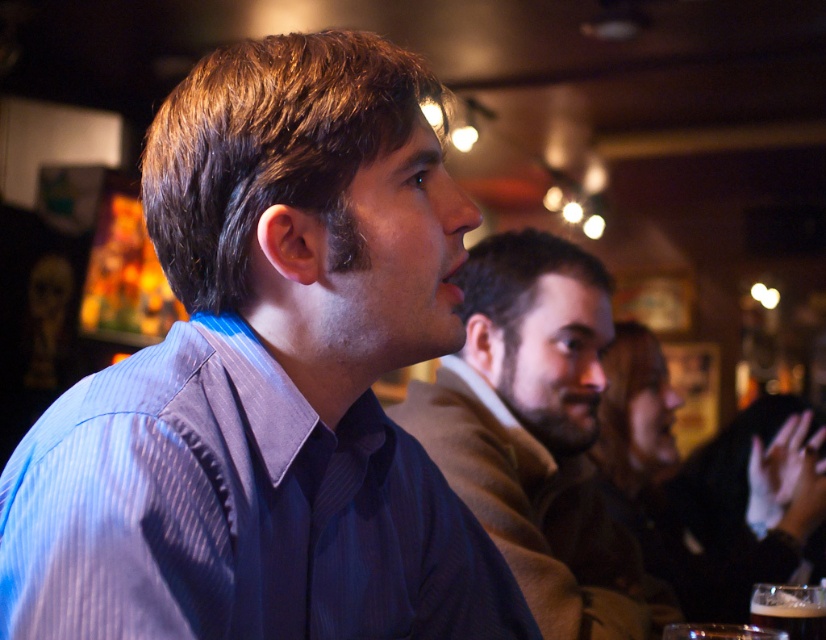
You are a photographer trying to capture a group photo of the people in the scene. You want to ensure that both the blue striped shirt at center and the matte blue shirt at center are clearly visible in the frame. Which shirt should you position closer to the camera to ensure both are in focus?

The blue striped shirt at center is positioned on the left side of matte blue shirt at center. To ensure both are in focus, position the blue striped shirt at center closer to the camera since it is already on the left side, allowing the depth of field to cover both subjects effectively.

You are a photographer setting up a shot in this scene. You need to ensure that the blue striped shirt at center and the dark brown glass at lower right are both in focus. Given their relative sizes, which object should you adjust your focus to prioritize to capture both effectively?

The blue striped shirt at center is taller than the dark brown glass at lower right. To ensure both are in focus, prioritize focusing on the blue striped shirt at center since it is larger and requires more detailed focus, while the smaller dark brown glass at lower right will likely remain in focus due to its smaller size.